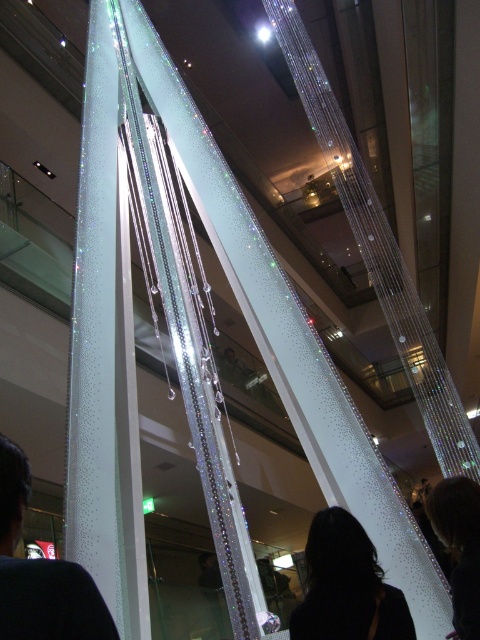
Question: Which point is farther from the camera taking this photo?

Choices:
 (A) (332, 509)
 (B) (17, 465)
 (C) (475, 556)

Answer: (A)

Question: Is black fabric at lower left above black hair at center?

Choices:
 (A) yes
 (B) no

Answer: (A)

Question: Which is nearer to the black fabric at lower left?

Choices:
 (A) dark hair at lower right
 (B) black hair at center

Answer: (B)

Question: Can you confirm if black hair at center is positioned above dark hair at lower right?

Choices:
 (A) no
 (B) yes

Answer: (B)

Question: Which of the following is the farthest from the observer?

Choices:
 (A) (2, 636)
 (B) (327, 618)
 (C) (469, 579)

Answer: (C)

Question: Is black fabric at lower left to the left of black hair at center from the viewer's perspective?

Choices:
 (A) no
 (B) yes

Answer: (B)